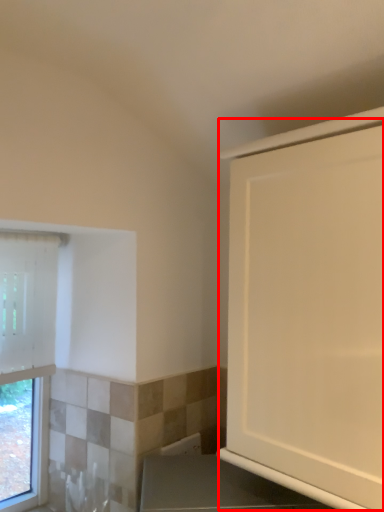
Question: From the image, what is the correct spatial relationship of screen door (annotated by the red box) in relation to window?

Choices:
 (A) right
 (B) left

Answer: (A)